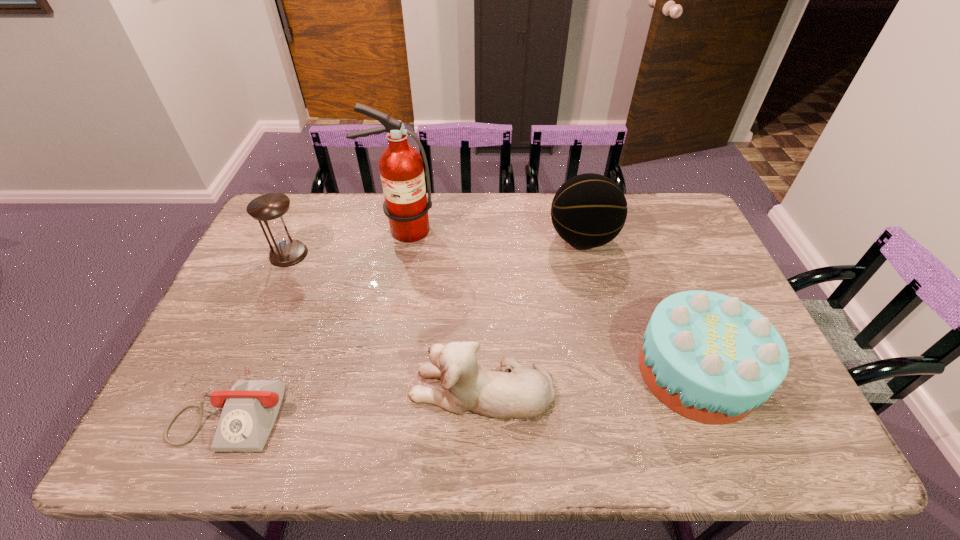
This screenshot has height=540, width=960. Find the location of `the tallest object`. the tallest object is located at coordinates (401, 168).

Locate an element on the screen. basketball is located at coordinates (589, 210).

The image size is (960, 540). Identify the location of hourglass. (270, 209).

You are a GUI agent. You are given a task and a screenshot of the screen. Output one action in this format:
    pyautogui.click(x=<x>, y=<y>)
    Task: Click on the cake
    This screenshot has height=540, width=960.
    Given the screenshot: What is the action you would take?
    pyautogui.click(x=711, y=358)

You are a GUI agent. You are given a task and a screenshot of the screen. Output one action in this format:
    pyautogui.click(x=<x>, y=<y>)
    Task: Click on the puppy
    
    Given the screenshot: What is the action you would take?
    pyautogui.click(x=523, y=393)

Find the location of `telephone`. telephone is located at coordinates (250, 408).

This screenshot has height=540, width=960. I want to click on free point located on the nozzle and handle of the fire extinguisher, so click(396, 261).

Locate an element on the screen. vacant area situated 0.350m on the front of the basketball is located at coordinates (612, 356).

At what (x,y) coordinates should I click in order to perform the action: click on free location located 0.060m on the front of the hourglass. Please return your answer as a coordinate pair (x, y). The height and width of the screenshot is (540, 960). Looking at the image, I should click on (276, 281).

This screenshot has width=960, height=540. What are the coordinates of `vacant space located on the front of the cake` in the screenshot? It's located at (728, 449).